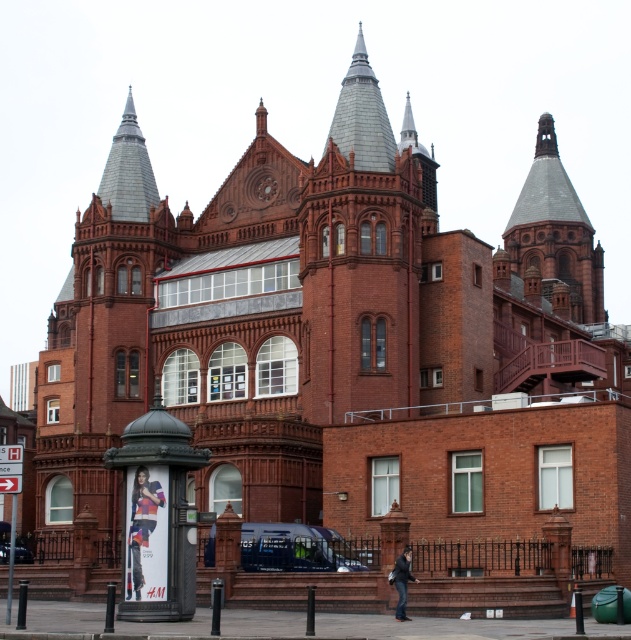
You are a window cleaner standing at the base of the shiny silver spire at upper center and the dark blue leather jacket at lower center. Which object do you need to climb higher to clean?

The shiny silver spire at upper center requires climbing higher because it has a greater height compared to the dark blue leather jacket at lower center.